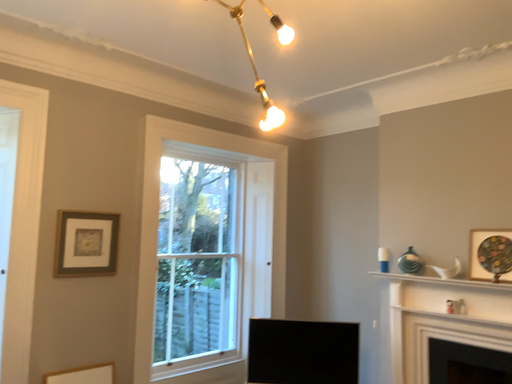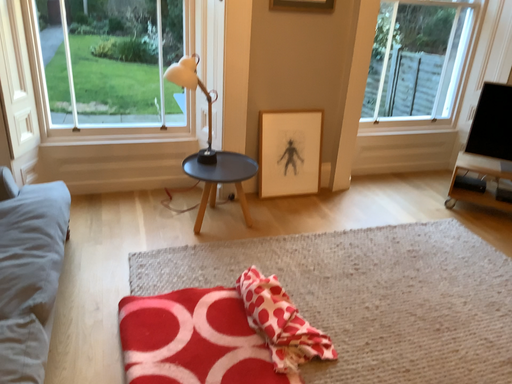
Question: Which way did the camera rotate in the video?

Choices:
 (A) rotated left
 (B) rotated right

Answer: (A)